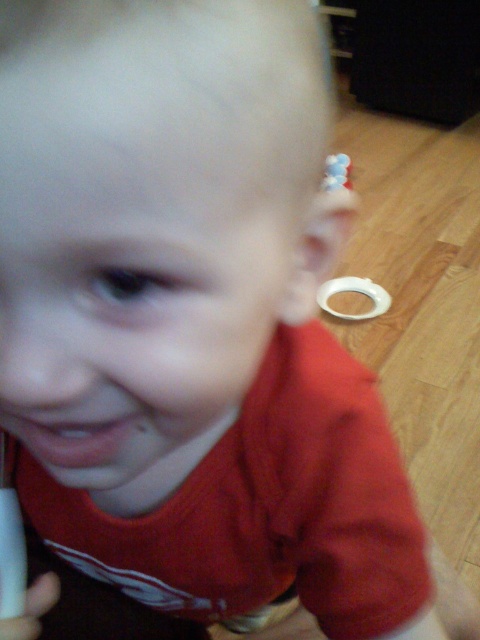
Is point (27, 442) positioned behind point (343, 163)?

No, it is not.

Between pink matte lips at center and white plastic toy at upper right, which one is positioned lower?

pink matte lips at center

The image size is (480, 640). Identify the location of pink matte lips at center. (71, 440).